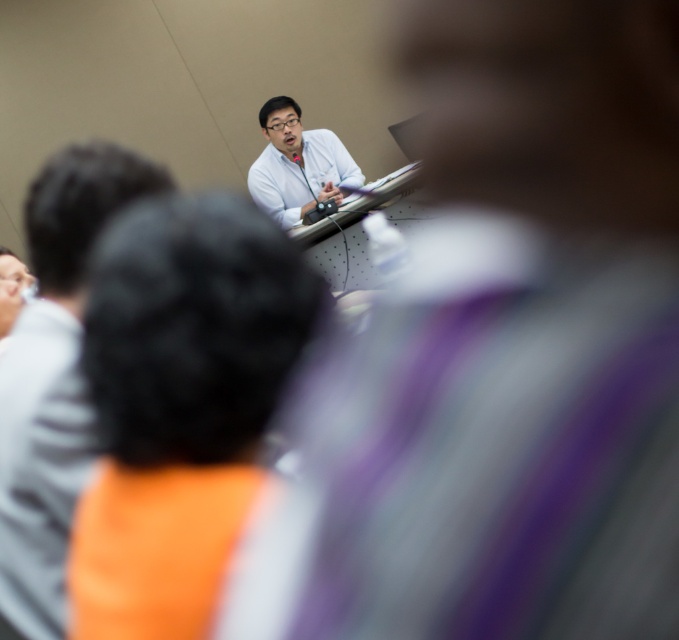
Question: Can you confirm if matte white shirt at upper center is positioned to the right of white glossy shirt at center?

Choices:
 (A) no
 (B) yes

Answer: (A)

Question: Is matte white shirt at upper center further to the viewer compared to white glossy shirt at center?

Choices:
 (A) no
 (B) yes

Answer: (A)

Question: Which point appears closest to the camera in this image?

Choices:
 (A) (359, 177)
 (B) (18, 529)

Answer: (B)

Question: Can you confirm if matte white shirt at upper center is wider than white glossy shirt at center?

Choices:
 (A) no
 (B) yes

Answer: (A)